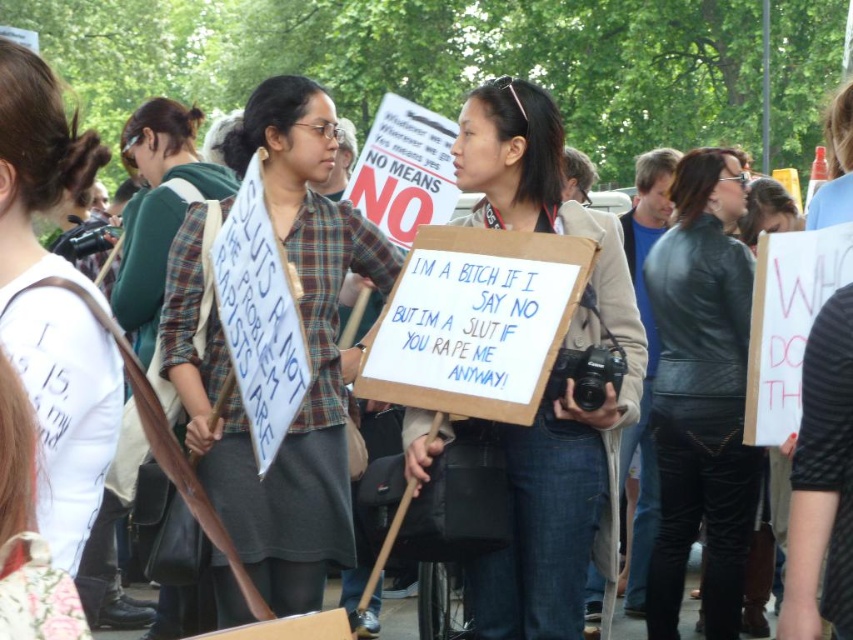
What is the spatial relationship between the plaid shirt at center and the green plaid shirt at upper left?

The plaid shirt at center is positioned under the green plaid shirt at upper left.

You are a photographer trying to capture a photo of the plaid shirt at center and the cardboard sign at center. If you want to ensure both are fully visible in the frame, which object should you adjust your focus on to accommodate their sizes?

The plaid shirt at center is wider than the cardboard sign at center, so you should focus on the plaid shirt at center to ensure it fits within the frame.

Based on the scene description, where is the plaid shirt at center located in terms of coordinates?

The plaid shirt at center is located at point coordinates of 0.545 along the x axis and 0.361 along the y axis.